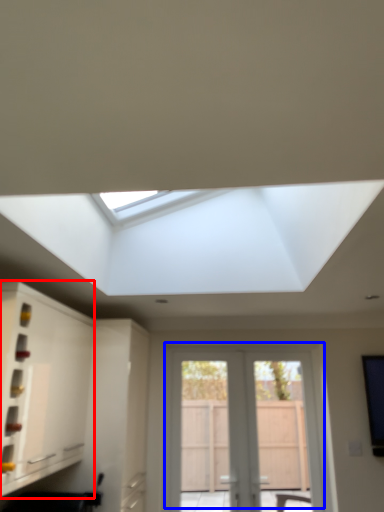
Question: Among these objects, which one is nearest to the camera, cabinetry (highlighted by a red box) or door (highlighted by a blue box)?

Choices:
 (A) cabinetry
 (B) door

Answer: (A)